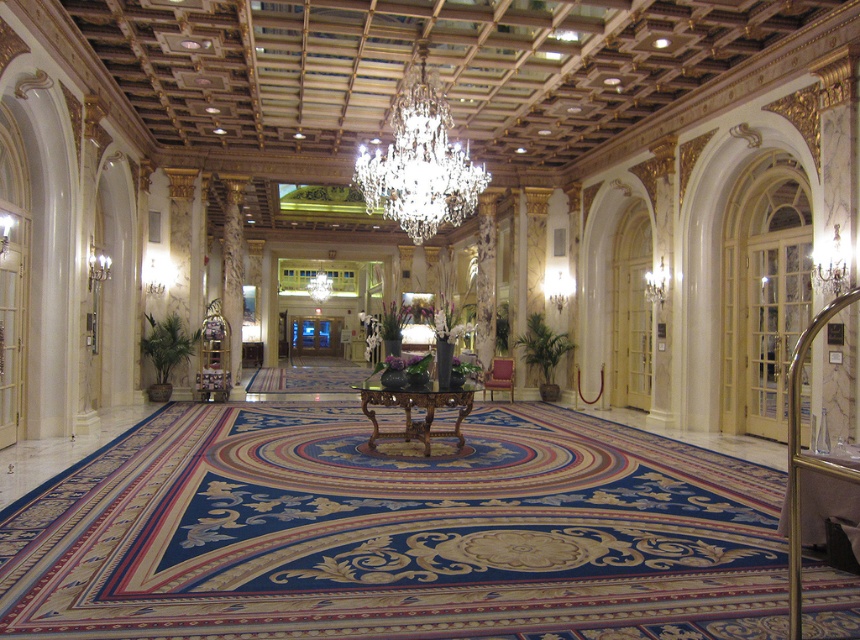
Based on the photo, you are a maintenance worker needing to inspect the crystal glass chandelier at center and the satin burgundy chair at center. Given that your ladder can extend up to 12 feet, can you safely reach both objects without moving the ladder?

The distance between the crystal glass chandelier at center and the satin burgundy chair at center is 13.47 feet. Since the ladder only extends to 12 feet, you cannot safely reach both objects without moving the ladder.

You are an interior designer planning to install a new lighting fixture in this space. You have a new chandelier that is exactly the same size as the gold metallic door at center. Will your new chandelier be smaller or larger than the existing crystal glass chandelier at center?

The crystal glass chandelier at center is larger in size than the gold metallic door at center. Since the new chandelier is the same size as the gold metallic door at center, it will be smaller than the existing crystal glass chandelier at center.

You are standing in the grand lobby and want to locate the crystal glass chandelier at center. According to the coordinates provided, what is its exact position in the image?

The crystal glass chandelier at center is located at the coordinates point (419, 163).